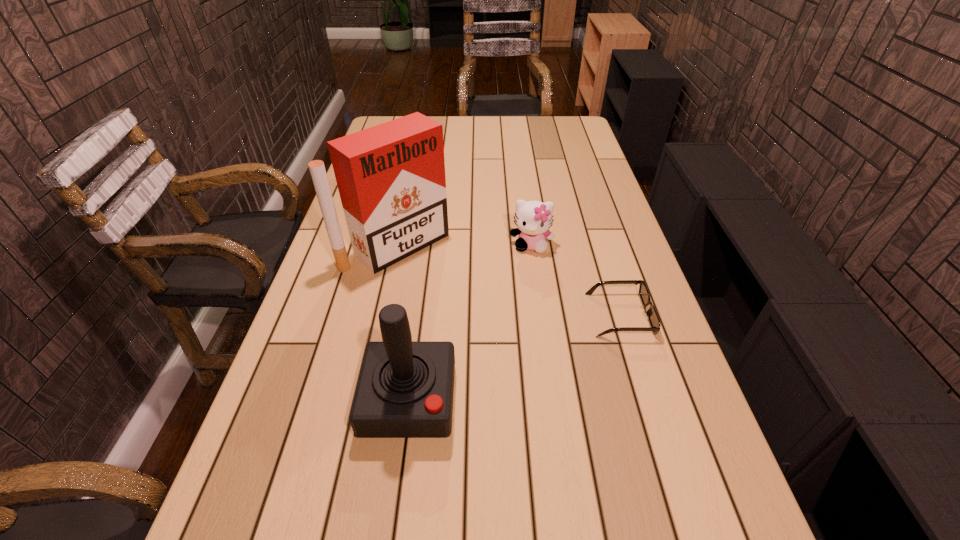
Locate an element on the screen. This screenshot has width=960, height=540. vacant region at the near right corner of the desktop is located at coordinates (691, 500).

Where is `empty space that is in between the third tallest object and the joystick`? empty space that is in between the third tallest object and the joystick is located at coordinates (470, 322).

Where is `free space between the second shortest object and the tallest object`? Image resolution: width=960 pixels, height=540 pixels. free space between the second shortest object and the tallest object is located at coordinates (464, 245).

Find the location of a particular element. This screenshot has height=540, width=960. free spot between the second tallest object and the sunglasses is located at coordinates (515, 357).

Where is `free point between the cigarette case and the second shortest object`? free point between the cigarette case and the second shortest object is located at coordinates (464, 245).

Where is `vacant area that lies between the rightmost object and the kitten`? vacant area that lies between the rightmost object and the kitten is located at coordinates (575, 280).

The image size is (960, 540). Find the location of `free space between the third shortest object and the third tallest object`. free space between the third shortest object and the third tallest object is located at coordinates (470, 322).

This screenshot has width=960, height=540. In order to click on free space that is in between the third farthest object and the second shortest object in this screenshot , I will do `click(575, 280)`.

What are the coordinates of `free point between the tallest object and the sunglasses` in the screenshot? It's located at (508, 280).

This screenshot has width=960, height=540. Find the location of `free space between the second nearest object and the cigarette case`. free space between the second nearest object and the cigarette case is located at coordinates (508, 280).